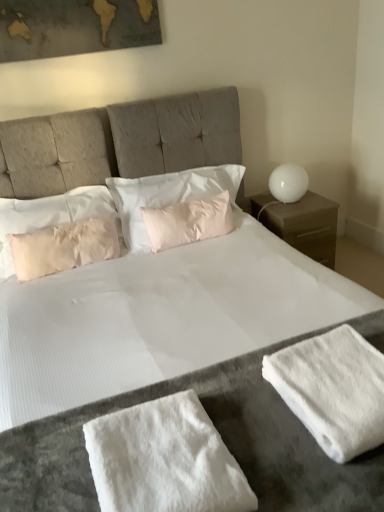
Question: Does pink textured pillow at center, the first pillow when ordered from right to left, appear on the right side of pink satin pillow at center, the second pillow viewed from the right?

Choices:
 (A) no
 (B) yes

Answer: (B)

Question: Does pink textured pillow at center, which is the 3th pillow from left to right, have a greater width compared to pink satin pillow at center, which is the 2th pillow from left to right?

Choices:
 (A) yes
 (B) no

Answer: (B)

Question: From a real-world perspective, is pink textured pillow at center, which is the 3th pillow from left to right, physically below pink satin pillow at center, the second pillow viewed from the right?

Choices:
 (A) no
 (B) yes

Answer: (B)

Question: Is pink textured pillow at center, the first pillow when ordered from right to left, oriented towards pink satin pillow at center, the second pillow viewed from the right?

Choices:
 (A) yes
 (B) no

Answer: (A)

Question: From the image's perspective, would you say pink textured pillow at center, the first pillow when ordered from right to left, is positioned over pink satin pillow at center, which is the 2th pillow from left to right?

Choices:
 (A) no
 (B) yes

Answer: (A)

Question: Is white fluffy bath towel at lower right to the left or to the right of white fluffy towel at lower center in the image?

Choices:
 (A) left
 (B) right

Answer: (B)

Question: Considering the positions of point (370, 415) and point (223, 489), is point (370, 415) closer or farther from the camera than point (223, 489)?

Choices:
 (A) farther
 (B) closer

Answer: (A)

Question: From a real-world perspective, is white fluffy bath towel at lower right above or below white fluffy towel at lower center?

Choices:
 (A) above
 (B) below

Answer: (B)

Question: Would you say white fluffy bath towel at lower right is inside or outside white fluffy towel at lower center?

Choices:
 (A) inside
 (B) outside

Answer: (B)

Question: Is white matte nightstand at right wider or thinner than pink textured pillow at center, which is the 3th pillow from left to right?

Choices:
 (A) wide
 (B) thin

Answer: (A)

Question: Considering the positions of white matte nightstand at right and pink textured pillow at center, which is the 3th pillow from left to right, in the image, is white matte nightstand at right taller or shorter than pink textured pillow at center, which is the 3th pillow from left to right,?

Choices:
 (A) tall
 (B) short

Answer: (A)

Question: From the image's perspective, relative to pink textured pillow at center, which is the 3th pillow from left to right, is white matte nightstand at right above or below?

Choices:
 (A) below
 (B) above

Answer: (A)

Question: Based on their sizes in the image, would you say white matte nightstand at right is bigger or smaller than pink textured pillow at center, which is the 3th pillow from left to right?

Choices:
 (A) big
 (B) small

Answer: (A)

Question: In the image, is white fluffy towel at lower center positioned in front of or behind white matte nightstand at right?

Choices:
 (A) front
 (B) behind

Answer: (A)

Question: In terms of height, does white fluffy towel at lower center look taller or shorter compared to white matte nightstand at right?

Choices:
 (A) tall
 (B) short

Answer: (B)